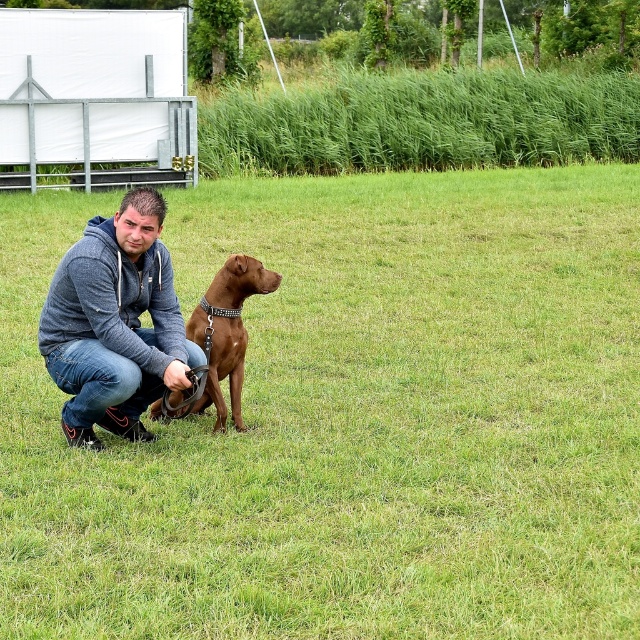
Question: Which of the following is the closest to the observer?

Choices:
 (A) (97, 417)
 (B) (13, 356)

Answer: (A)

Question: Is brown leather dog at center positioned before jeans at left?

Choices:
 (A) yes
 (B) no

Answer: (A)

Question: Which point is farther to the camera?

Choices:
 (A) brown glossy dog at center
 (B) gray hoodie at lower left
 (C) brown leather dog at center
 (D) jeans at left

Answer: (A)

Question: Does brown leather dog at center appear on the right side of gray hoodie at lower left?

Choices:
 (A) yes
 (B) no

Answer: (A)

Question: Which object is the closest to the gray hoodie at lower left?

Choices:
 (A) jeans at left
 (B) brown leather dog at center

Answer: (A)

Question: Is gray hoodie at lower left above jeans at left?

Choices:
 (A) no
 (B) yes

Answer: (B)